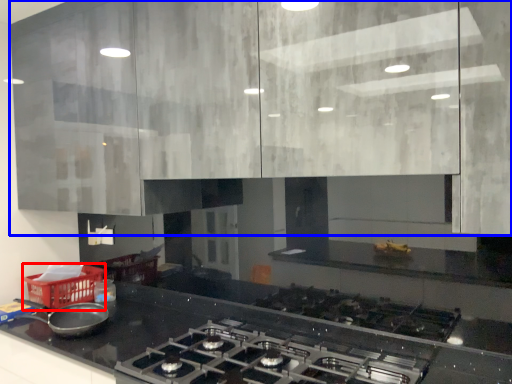
Question: Which of the following is the closest to the observer, basket (highlighted by a red box) or cabinetry (highlighted by a blue box)?

Choices:
 (A) basket
 (B) cabinetry

Answer: (B)